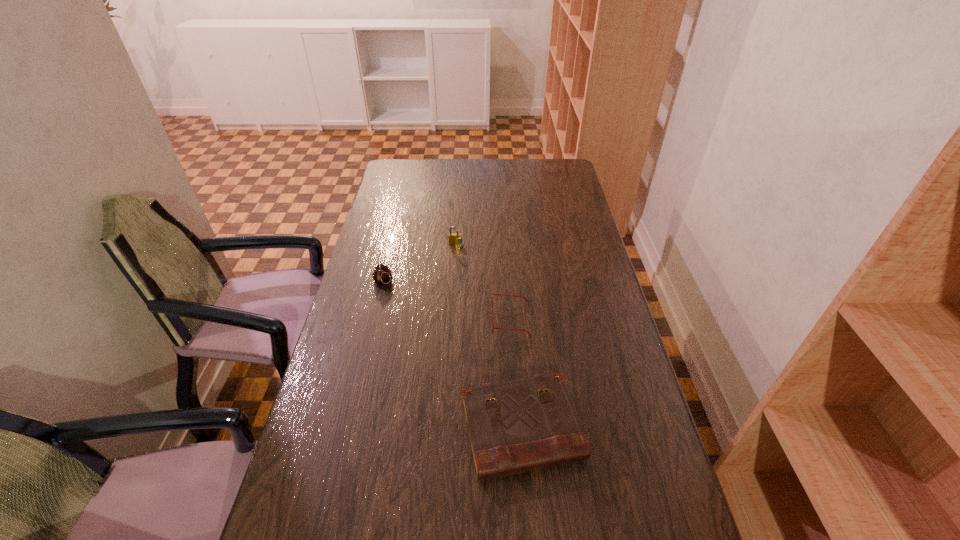
Locate an element on the screen. The height and width of the screenshot is (540, 960). free space between the second object from left to right and the spectacles is located at coordinates (484, 282).

Identify the location of empty location between the hardback book and the pinecone. The image size is (960, 540). (452, 356).

Identify the location of vacant space in between the nearest object and the spectacles. Image resolution: width=960 pixels, height=540 pixels. (516, 374).

Locate an element on the screen. Image resolution: width=960 pixels, height=540 pixels. unoccupied position between the spectacles and the pinecone is located at coordinates (446, 301).

Locate an element on the screen. This screenshot has height=540, width=960. vacant space that is in between the padlock and the shortest object is located at coordinates (484, 282).

Find the location of a particular element. Image resolution: width=960 pixels, height=540 pixels. object that is the third closest one to the third object from right to left is located at coordinates (522, 425).

This screenshot has height=540, width=960. In order to click on the third closest object to the third object from right to left in this screenshot , I will do `click(522, 425)`.

Identify the location of free space that satisfies the following two spatial constraints: 1. on the face of the hardback book; 2. on the left side of the second nearest object. (518, 430).

The height and width of the screenshot is (540, 960). Find the location of `vacant position in the image that satisfies the following two spatial constraints: 1. on the side with the combination dials of the nearest object; 2. on the left side of the padlock`. vacant position in the image that satisfies the following two spatial constraints: 1. on the side with the combination dials of the nearest object; 2. on the left side of the padlock is located at coordinates (444, 430).

This screenshot has height=540, width=960. What are the coordinates of `free region that satisfies the following two spatial constraints: 1. on the side with the combination dials of the hardback book; 2. on the left side of the padlock` in the screenshot? It's located at (444, 430).